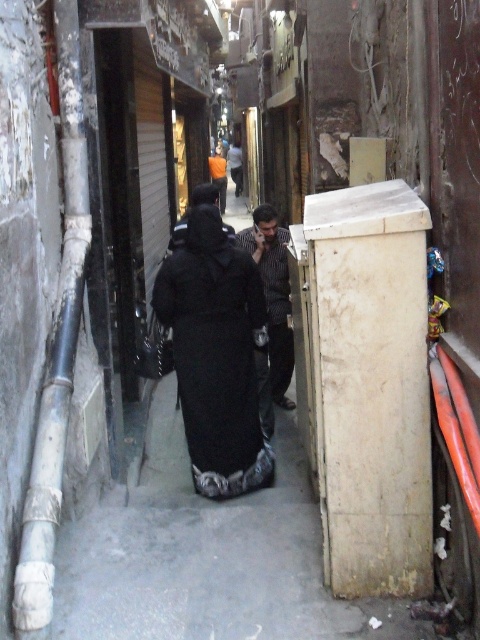
Question: In this image, where is black matte dress at center located relative to striped shirt at center?

Choices:
 (A) above
 (B) below

Answer: (B)

Question: Observing the image, what is the correct spatial positioning of black matte dress at center in reference to striped shirt at center?

Choices:
 (A) right
 (B) left

Answer: (B)

Question: Among these points, which one is farthest from the camera?

Choices:
 (A) (267, 420)
 (B) (255, 454)

Answer: (A)

Question: Is black matte dress at center to the left of striped shirt at center from the viewer's perspective?

Choices:
 (A) no
 (B) yes

Answer: (B)

Question: Which object is closer to the camera taking this photo?

Choices:
 (A) black matte dress at center
 (B) striped shirt at center

Answer: (A)